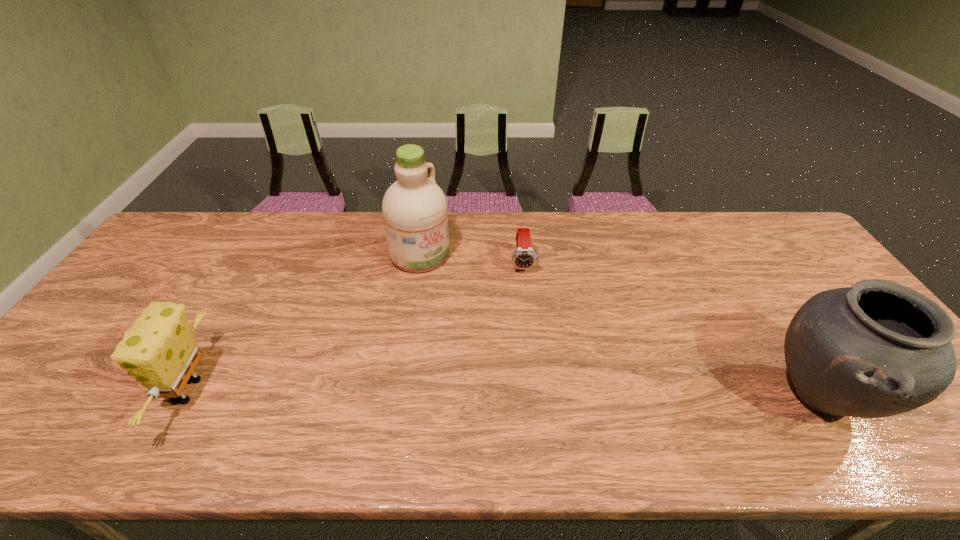
This screenshot has height=540, width=960. Find the location of `sponge`. sponge is located at coordinates (159, 350).

Where is `the leftmost object`? the leftmost object is located at coordinates (159, 350).

The image size is (960, 540). In order to click on urn in this screenshot , I will do `click(876, 349)`.

Where is `the rightmost object`? This screenshot has height=540, width=960. the rightmost object is located at coordinates (876, 349).

Locate an element on the screen. the second object from left to right is located at coordinates (415, 211).

Locate an element on the screen. The image size is (960, 540). the tallest object is located at coordinates (415, 211).

At what (x,y) coordinates should I click in order to perform the action: click on the third object from left to right. Please return your answer as a coordinate pair (x, y). Image resolution: width=960 pixels, height=540 pixels. Looking at the image, I should click on (524, 257).

Locate an element on the screen. This screenshot has width=960, height=540. watch is located at coordinates coord(524,257).

You are a GUI agent. You are given a task and a screenshot of the screen. Output one action in this format:
    pyautogui.click(x=<x>, y=<y>)
    Task: Click on the free location located on the face of the leftmost object
    The image size is (960, 540).
    Given the screenshot: What is the action you would take?
    (x=136, y=391)

The image size is (960, 540). I want to click on free space located 0.260m on the face of the leftmost object, so click(x=56, y=391).